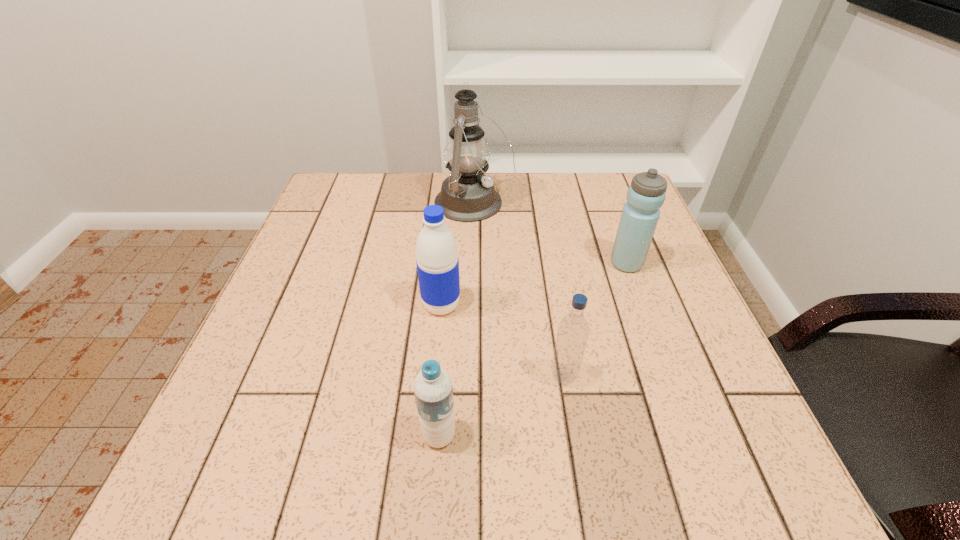
Locate an element on the screen. Image resolution: width=960 pixels, height=540 pixels. the farthest object is located at coordinates (467, 195).

Locate an element on the screen. The height and width of the screenshot is (540, 960). the tallest object is located at coordinates (467, 195).

What are the coordinates of `the rightmost object` in the screenshot? It's located at (646, 194).

Locate an element on the screen. Image resolution: width=960 pixels, height=540 pixels. the second farthest object is located at coordinates (646, 194).

This screenshot has height=540, width=960. Identify the location of the third nearest water bottle. (437, 261).

At what (x,y) coordinates should I click in order to perform the action: click on the second water bottle from right to left. Please return your answer as a coordinate pair (x, y). The width and height of the screenshot is (960, 540). Looking at the image, I should click on (573, 330).

You are a GUI agent. You are given a task and a screenshot of the screen. Output one action in this format:
    pyautogui.click(x=<x>, y=<y>)
    Task: Click on the fourth farthest object
    
    Given the screenshot: What is the action you would take?
    pyautogui.click(x=573, y=330)

Where is `the nearest object`? Image resolution: width=960 pixels, height=540 pixels. the nearest object is located at coordinates (433, 389).

Image resolution: width=960 pixels, height=540 pixels. I want to click on vacant area situated on the front of the tallest object, so click(472, 285).

This screenshot has height=540, width=960. I want to click on free location located on the back of the second farthest object, so [600, 191].